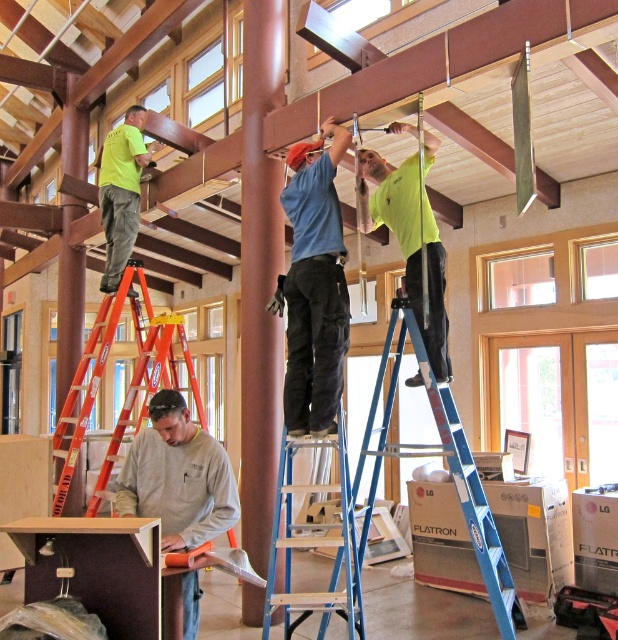
What is located at the coordinates point (315,285)?

Blue denim jeans at center is located at point (315,285).

From the picture: You are a construction worker in the building. You need to locate the bright yellow shirt at upper center and the neon green shirt at upper left. According to the scene, which shirt is positioned to the right of the other?

The bright yellow shirt at upper center is to the right of the neon green shirt at upper left.